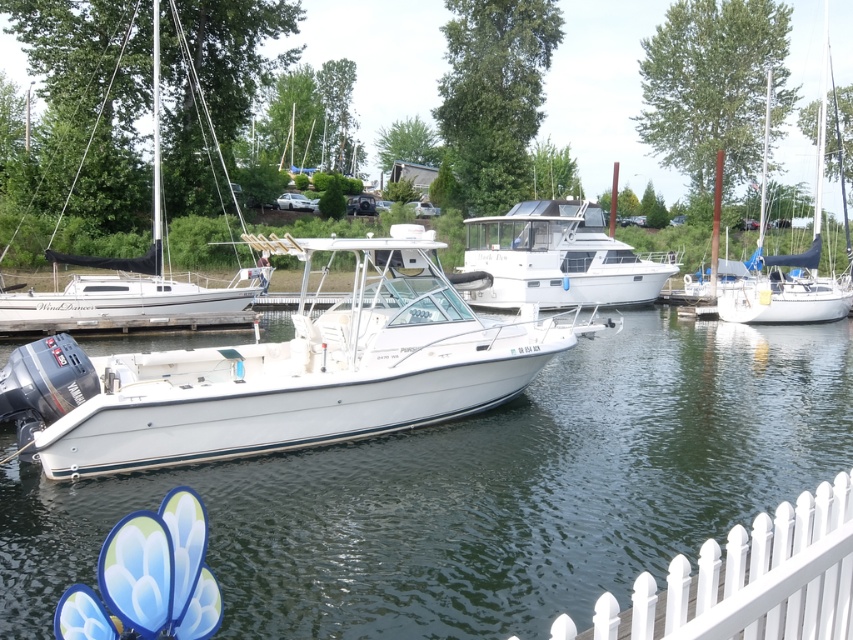
Does white picket fence at lower right have a larger size compared to white matte sailboat at right?

Actually, white picket fence at lower right might be smaller than white matte sailboat at right.

Does white picket fence at lower right have a greater width compared to white matte sailboat at right?

No.

Does point (805, 531) lie behind point (808, 314)?

No, (805, 531) is in front of (808, 314).

Locate an element on the screen. white picket fence at lower right is located at coordinates (747, 580).

Which is more to the left, white glossy water at center or white picket fence at lower right?

white glossy water at center is more to the left.

Does white glossy water at center have a larger size compared to white picket fence at lower right?

Yes, white glossy water at center is bigger than white picket fence at lower right.

Locate an element on the screen. The width and height of the screenshot is (853, 640). white glossy water at center is located at coordinates (480, 492).

Where is `white glossy water at center`? The height and width of the screenshot is (640, 853). white glossy water at center is located at coordinates (480, 492).

Does white glossy water at center have a smaller size compared to white glossy boat at center?

Actually, white glossy water at center might be larger than white glossy boat at center.

Can you confirm if white glossy water at center is positioned to the left of white glossy boat at center?

Yes, white glossy water at center is to the left of white glossy boat at center.

What do you see at coordinates (480, 492) in the screenshot?
I see `white glossy water at center` at bounding box center [480, 492].

Identify the location of white glossy water at center. (480, 492).